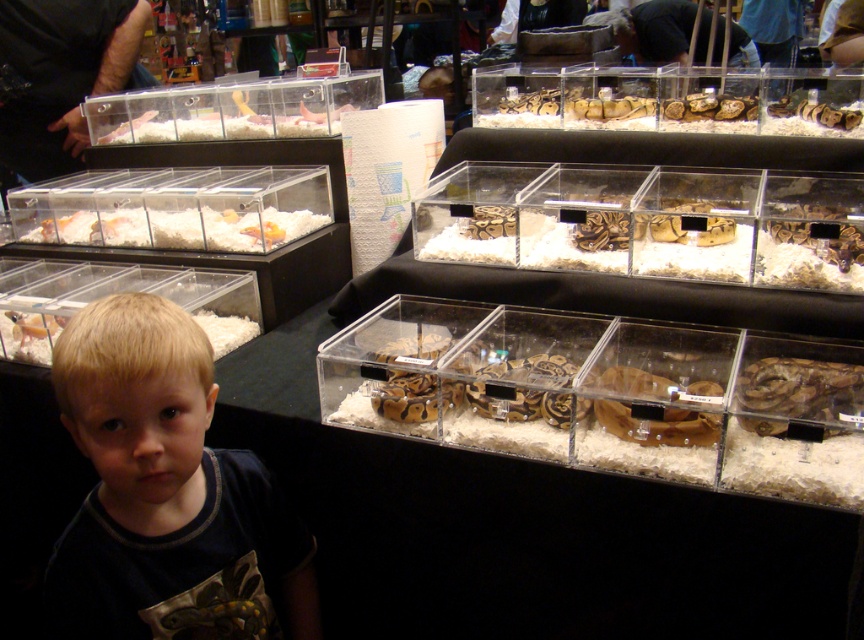
Question: Does brown textured snake at upper center appear under white fluffy bedding at lower left?

Choices:
 (A) no
 (B) yes

Answer: (A)

Question: Does brown textured snake at upper center appear over translucent plastic container at center?

Choices:
 (A) yes
 (B) no

Answer: (A)

Question: Does brown patterned snake at center have a smaller size compared to brown textured snake at upper center?

Choices:
 (A) yes
 (B) no

Answer: (B)

Question: Which of the following is the closest to the observer?

Choices:
 (A) (833, 408)
 (B) (248, 324)
 (C) (685, 234)
 (D) (100, 531)

Answer: (D)

Question: Which point is farther from the camera taking this photo?

Choices:
 (A) (157, 230)
 (B) (271, 536)
 (C) (691, 104)

Answer: (A)

Question: Which point is closer to the camera?

Choices:
 (A) brown patterned snake at center
 (B) white fluffy bedding at lower left
 (C) brown textured snake at lower right
 (D) brown textured snake at upper center

Answer: (C)